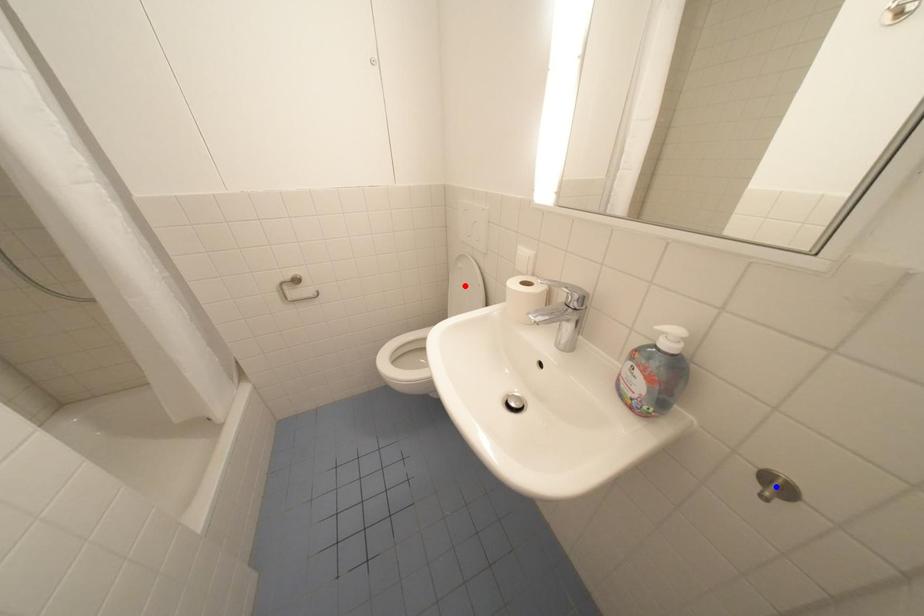
Question: In the image, two points are highlighted. Which point is nearer to the camera? Reply with the corresponding letter.

Choices:
 (A) blue point
 (B) red point

Answer: (A)